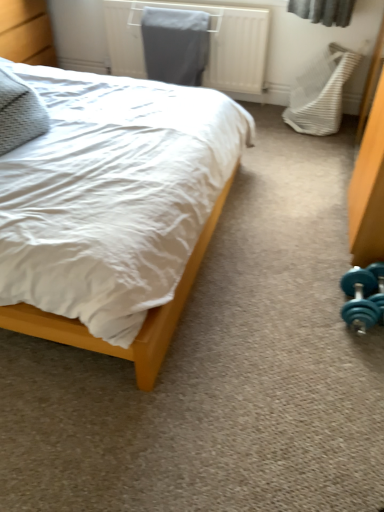
Locate an element on the screen. free space between teal rubber dumbbell at lower right and white textured swivel chair at right is located at coordinates (319, 186).